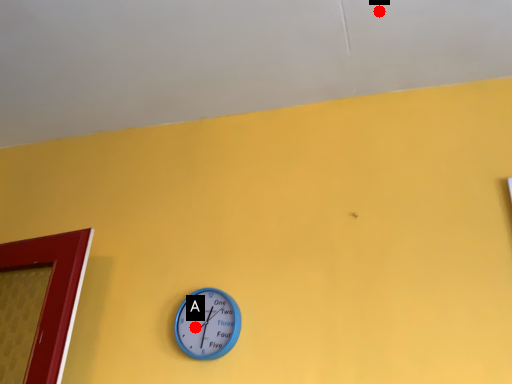
Question: Two points are circled on the image, labeled by A and B beside each circle. Which point is closer to the camera?

Choices:
 (A) A is closer
 (B) B is closer

Answer: (B)